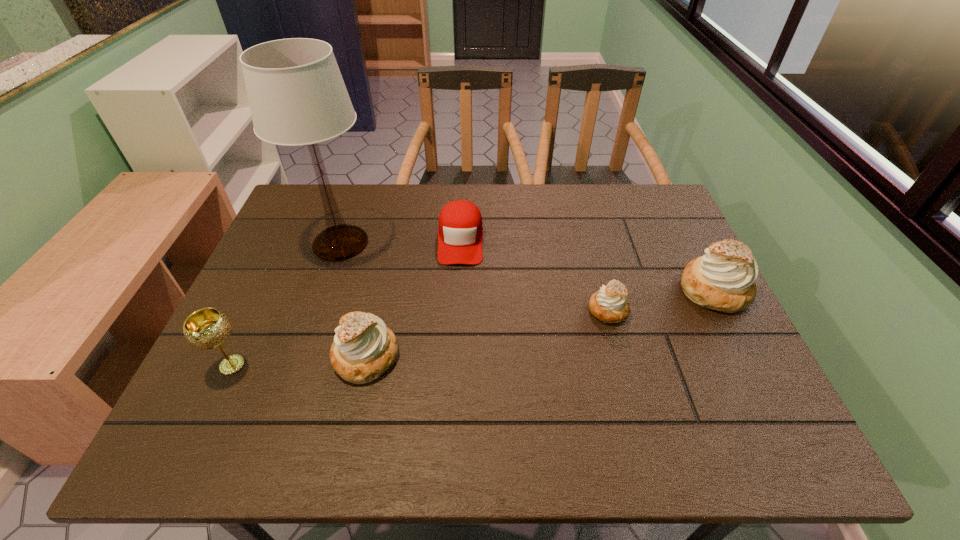
Identify the location of vacant position for inserting another pastry evenly. (492, 333).